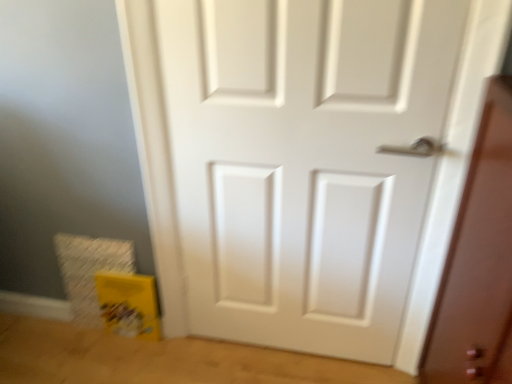
Question: From a real-world perspective, is white matte door at center above or below matte white door at right?

Choices:
 (A) above
 (B) below

Answer: (A)

Question: Is white matte door at center taller or shorter than matte white door at right?

Choices:
 (A) tall
 (B) short

Answer: (A)

Question: Is point (245, 223) positioned closer to the camera than point (480, 145)?

Choices:
 (A) closer
 (B) farther

Answer: (B)

Question: From a real-world perspective, relative to white matte door at center, is matte white door at right vertically above or below?

Choices:
 (A) above
 (B) below

Answer: (B)

Question: In terms of height, does matte white door at right look taller or shorter compared to white matte door at center?

Choices:
 (A) short
 (B) tall

Answer: (A)

Question: Is matte white door at right wider or thinner than white matte door at center?

Choices:
 (A) wide
 (B) thin

Answer: (A)

Question: Does point (485, 274) appear closer or farther from the camera than point (274, 296)?

Choices:
 (A) closer
 (B) farther

Answer: (A)